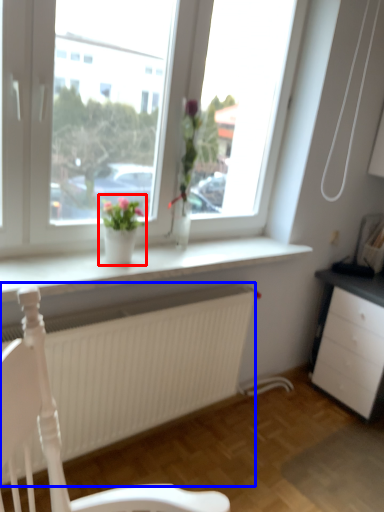
Question: Which point is further to the camera, houseplant (highlighted by a red box) or carpets (highlighted by a blue box)?

Choices:
 (A) houseplant
 (B) carpets

Answer: (A)